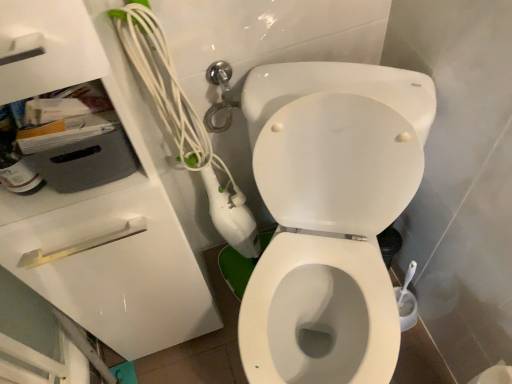
What do you see at coordinates (330, 216) in the screenshot? I see `white glossy toilet at center` at bounding box center [330, 216].

Identify the location of white glossy toilet at center. Image resolution: width=512 pixels, height=384 pixels. click(x=330, y=216).

Measure the distance between yellow plastic drawer at upper left and camera.

yellow plastic drawer at upper left and camera are 66.53 centimeters apart from each other.

What do you see at coordinates (112, 263) in the screenshot? This screenshot has height=384, width=512. I see `yellow plastic drawer at upper left` at bounding box center [112, 263].

This screenshot has width=512, height=384. Identify the location of yellow plastic drawer at upper left. (112, 263).

The image size is (512, 384). In order to click on white glossy toilet at center in this screenshot , I will do `click(330, 216)`.

Would you say yellow plastic drawer at upper left is to the left or to the right of white glossy toilet at center in the picture?

From the image, it's evident that yellow plastic drawer at upper left is to the left of white glossy toilet at center.

Consider the image. Considering the positions of objects yellow plastic drawer at upper left and white glossy toilet at center in the image provided, who is behind, yellow plastic drawer at upper left or white glossy toilet at center?

yellow plastic drawer at upper left is further from the camera.

Does point (125, 316) come behind point (378, 272)?

Yes, point (125, 316) is behind point (378, 272).

From the image's perspective, between yellow plastic drawer at upper left and white glossy toilet at center, who is located below?

yellow plastic drawer at upper left appears lower in the image.

From a real-world perspective, which is physically above, yellow plastic drawer at upper left or white glossy toilet at center?

From a 3D spatial view, white glossy toilet at center is above.

Consider the image. Looking at their sizes, would you say yellow plastic drawer at upper left is wider or thinner than white glossy toilet at center?

In the image, yellow plastic drawer at upper left appears to be more narrow than white glossy toilet at center.

Considering the relative sizes of yellow plastic drawer at upper left and white glossy toilet at center in the image provided, is yellow plastic drawer at upper left shorter than white glossy toilet at center?

Indeed, yellow plastic drawer at upper left has a lesser height compared to white glossy toilet at center.

Considering the sizes of yellow plastic drawer at upper left and white glossy toilet at center in the image, is yellow plastic drawer at upper left bigger or smaller than white glossy toilet at center?

Clearly, yellow plastic drawer at upper left is smaller in size than white glossy toilet at center.

Based on the photo, would you say white glossy toilet at center is part of yellow plastic drawer at upper left's contents?

That's incorrect, white glossy toilet at center is not inside yellow plastic drawer at upper left.

Is yellow plastic drawer at upper left next to white glossy toilet at center and touching it?

No, yellow plastic drawer at upper left is not beside white glossy toilet at center.

Could you tell me if yellow plastic drawer at upper left is facing white glossy toilet at center?

No.

There is a yellow plastic drawer at upper left. Where is `toilet above it (from a real-world perspective)`? toilet above it (from a real-world perspective) is located at coordinates (330, 216).

Which object is positioned more to the right, white glossy toilet at center or yellow plastic drawer at upper left?

white glossy toilet at center.

Does white glossy toilet at center lie behind yellow plastic drawer at upper left?

No, it is not.

Is point (273, 164) positioned before point (169, 239)?

No, it is behind (169, 239).

From the image's perspective, which is below, white glossy toilet at center or yellow plastic drawer at upper left?

yellow plastic drawer at upper left.

From a real-world perspective, is white glossy toilet at center beneath yellow plastic drawer at upper left?

No.

Considering the sizes of white glossy toilet at center and yellow plastic drawer at upper left in the image, is white glossy toilet at center wider or thinner than yellow plastic drawer at upper left?

Clearly, white glossy toilet at center has more width compared to yellow plastic drawer at upper left.

Who is taller, white glossy toilet at center or yellow plastic drawer at upper left?

white glossy toilet at center.

Is white glossy toilet at center smaller than yellow plastic drawer at upper left?

No.

Based on the photo, can we say white glossy toilet at center lies outside yellow plastic drawer at upper left?

Indeed, white glossy toilet at center is completely outside yellow plastic drawer at upper left.

Is white glossy toilet at center with yellow plastic drawer at upper left?

No, white glossy toilet at center is not beside yellow plastic drawer at upper left.

Is white glossy toilet at center aimed at yellow plastic drawer at upper left?

No, white glossy toilet at center is not turned towards yellow plastic drawer at upper left.

There is a yellow plastic drawer at upper left. Identify the location of toilet above it (from a real-world perspective). (330, 216).

Locate an element on the screen. The width and height of the screenshot is (512, 384). toilet lying on the right of yellow plastic drawer at upper left is located at coordinates (330, 216).

Where is `toilet that appears above the yellow plastic drawer at upper left (from the image's perspective)`? This screenshot has height=384, width=512. toilet that appears above the yellow plastic drawer at upper left (from the image's perspective) is located at coordinates (330, 216).